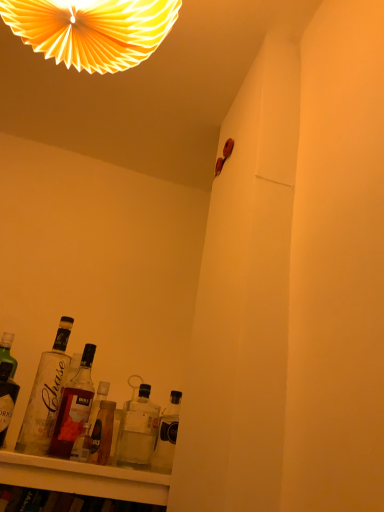
Question: Is clear glass bottle at lower left, positioned as the second bottle in left-to-right order, closer to the viewer compared to yellow paper fan at upper center?

Choices:
 (A) no
 (B) yes

Answer: (A)

Question: Is clear glass bottle at lower left, positioned as the second bottle in left-to-right order, outside yellow paper fan at upper center?

Choices:
 (A) yes
 (B) no

Answer: (A)

Question: Is clear glass bottle at lower left, positioned as the second bottle in left-to-right order, not close to yellow paper fan at upper center?

Choices:
 (A) no
 (B) yes

Answer: (A)

Question: Does clear glass bottle at lower left, positioned as the second bottle in left-to-right order, have a lesser width compared to yellow paper fan at upper center?

Choices:
 (A) yes
 (B) no

Answer: (A)

Question: Is clear glass bottle at lower left, positioned as the 4th bottle in right-to-left order, shorter than yellow paper fan at upper center?

Choices:
 (A) yes
 (B) no

Answer: (A)

Question: Is clear glass bottle at lower left, positioned as the 4th bottle in right-to-left order, bigger than yellow paper fan at upper center?

Choices:
 (A) yes
 (B) no

Answer: (B)

Question: Is translucent glass bottle at lower left, which is counted as the 3th bottle, starting from the right, turned away from translucent glass bottle at lower center, arranged as the 4th bottle when viewed from the left?

Choices:
 (A) yes
 (B) no

Answer: (B)

Question: Is translucent glass bottle at lower left, the 3th bottle from the left, far from translucent glass bottle at lower center, the 2th bottle when ordered from right to left?

Choices:
 (A) no
 (B) yes

Answer: (A)

Question: Is the surface of translucent glass bottle at lower left, which is counted as the 3th bottle, starting from the right, in direct contact with translucent glass bottle at lower center, arranged as the 4th bottle when viewed from the left?

Choices:
 (A) yes
 (B) no

Answer: (A)

Question: Is translucent glass bottle at lower left, which is counted as the 3th bottle, starting from the right, completely or partially outside of translucent glass bottle at lower center, arranged as the 4th bottle when viewed from the left?

Choices:
 (A) yes
 (B) no

Answer: (A)

Question: From the image's perspective, is translucent glass bottle at lower left, which is counted as the 3th bottle, starting from the right, beneath translucent glass bottle at lower center, arranged as the 4th bottle when viewed from the left?

Choices:
 (A) yes
 (B) no

Answer: (B)

Question: From a real-world perspective, is translucent glass bottle at lower left, the 3th bottle from the left, located higher than translucent glass bottle at lower center, arranged as the 4th bottle when viewed from the left?

Choices:
 (A) no
 (B) yes

Answer: (A)

Question: From a real-world perspective, does clear glass bottle at lower left, arranged as the 5th bottle when viewed from the right, stand above translucent glass bottle at lower center, the 2th bottle when ordered from right to left?

Choices:
 (A) no
 (B) yes

Answer: (B)